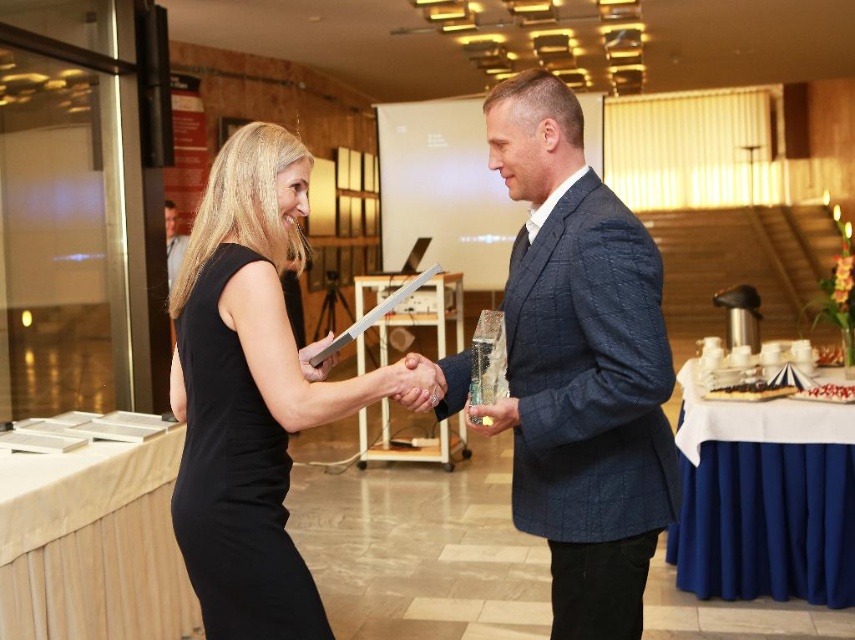
Question: Does blue fabric table at lower right appear on the right side of black satin dress at center?

Choices:
 (A) no
 (B) yes

Answer: (B)

Question: Which point is farther from the camera taking this photo?

Choices:
 (A) (89, 460)
 (B) (246, 410)
 (C) (437, 403)

Answer: (A)

Question: Does blue textured suit at center have a smaller size compared to blue fabric table at lower right?

Choices:
 (A) yes
 (B) no

Answer: (A)

Question: Does blue textured suit at center have a smaller size compared to white fabric table at lower left?

Choices:
 (A) yes
 (B) no

Answer: (A)

Question: Which point is closer to the camera taking this photo?

Choices:
 (A) (708, 536)
 (B) (304, 625)

Answer: (B)

Question: Which of the following is the farthest from the observer?

Choices:
 (A) (214, 280)
 (B) (187, 420)
 (C) (422, 384)

Answer: (C)